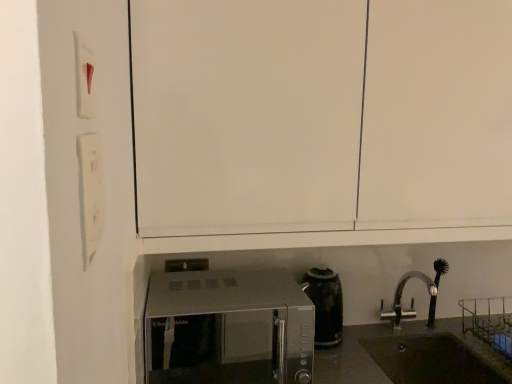
Where is `vacant point above satin silver microwave at lower center (from a real-world perspective)`? Image resolution: width=512 pixels, height=384 pixels. vacant point above satin silver microwave at lower center (from a real-world perspective) is located at coordinates (229, 291).